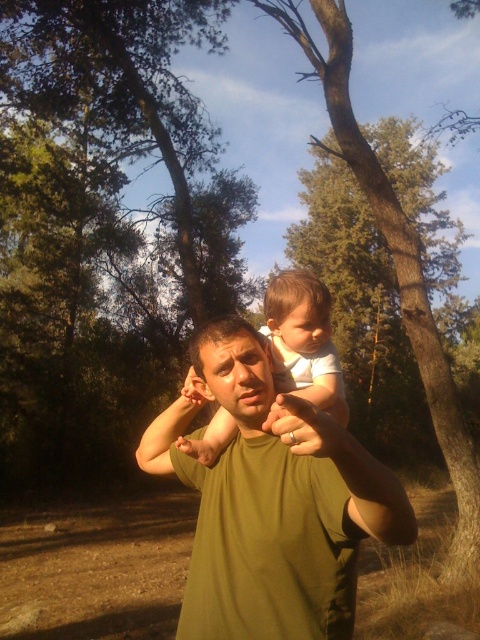
Consider the image. Is green matte shirt at center further to the viewer compared to white cotton baby at center?

That is False.

What are the coordinates of `green matte shirt at center` in the screenshot? It's located at (272, 502).

Identify the location of green matte shirt at center. (272, 502).